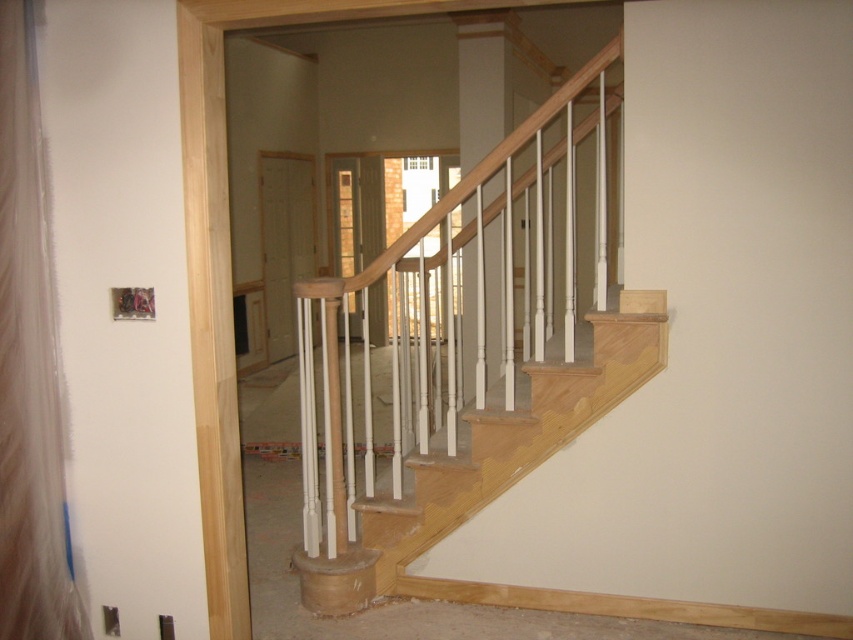
Measure the distance between natural wood handrail at center and light wood stairwell at center.

The distance of natural wood handrail at center from light wood stairwell at center is 9.38 inches.

Does natural wood handrail at center appear under light wood stairwell at center?

No, natural wood handrail at center is not below light wood stairwell at center.

Is point (529, 186) in front of point (334, 353)?

That is False.

You are a GUI agent. You are given a task and a screenshot of the screen. Output one action in this format:
    pyautogui.click(x=<x>, y=<y>)
    Task: Click on the natural wood handrail at center
    
    Given the screenshot: What is the action you would take?
    pyautogui.click(x=461, y=317)